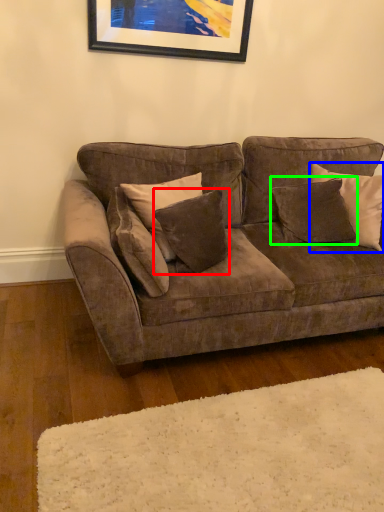
Question: Based on their relative distances, which object is nearer to pillow (highlighted by a red box)? Choose from pillow (highlighted by a blue box) and pillow (highlighted by a green box).

Choices:
 (A) pillow
 (B) pillow

Answer: (B)